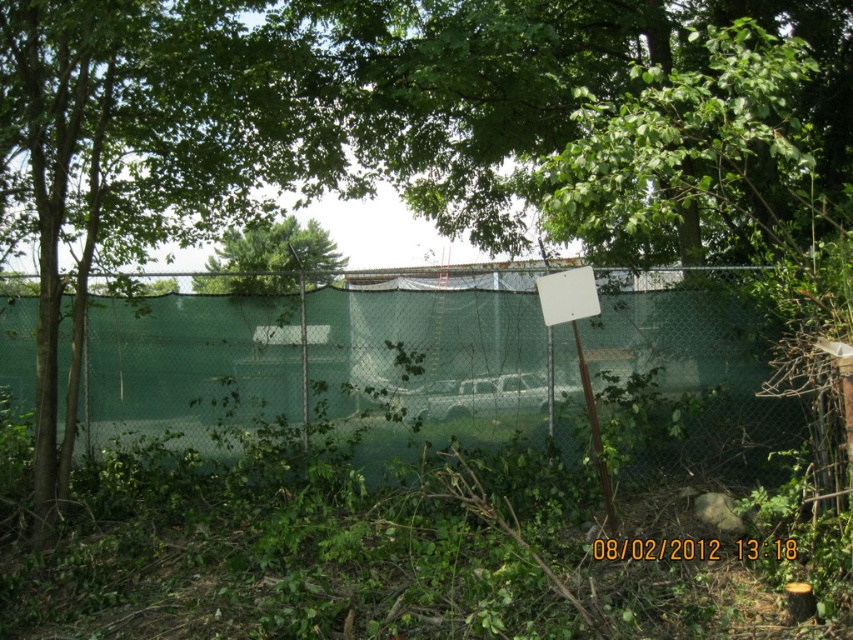
You are trying to see the white vehicle parked behind the green mesh fence at center and the green leafy tree at center. Which object is taller and might block your view more?

The green mesh fence at center is much taller than the green leafy tree at center, so it would block your view more.

You are standing at the point with coordinates point (235, 266) and want to walk towards the point with coordinates point (733, 392). Will you have a clear path without obstacles between these two points?

Point (733, 392) is in front of point (235, 266), so yes, you will have a clear path without obstacles between these two points.

You are standing in a park and see the green mesh fence at center and the green leafy tree at center. Which object is positioned to the right of the other?

The green mesh fence at center is to the right of the green leafy tree at center.